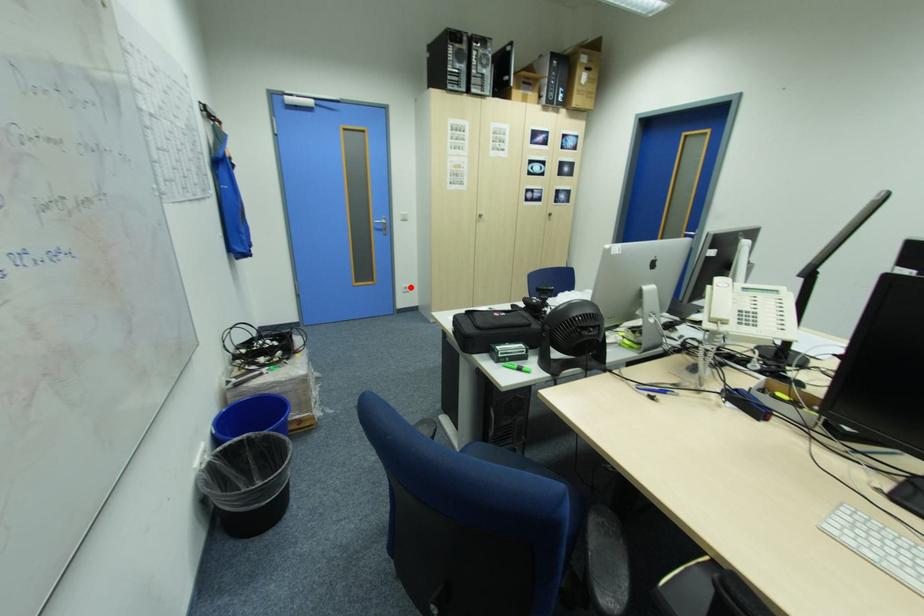
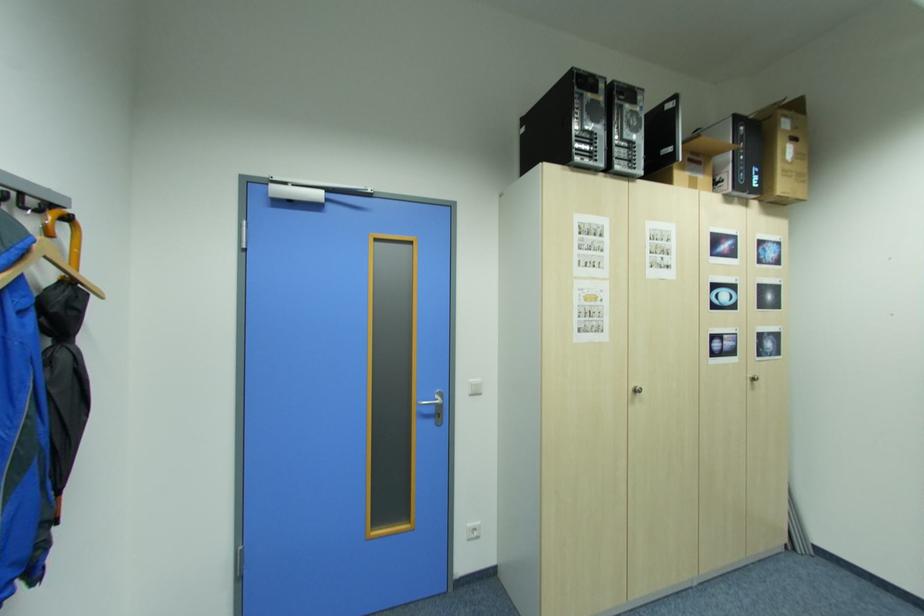
The point at the highlighted location is marked in the first image. Where is the corresponding point in the second image?

(476, 529)